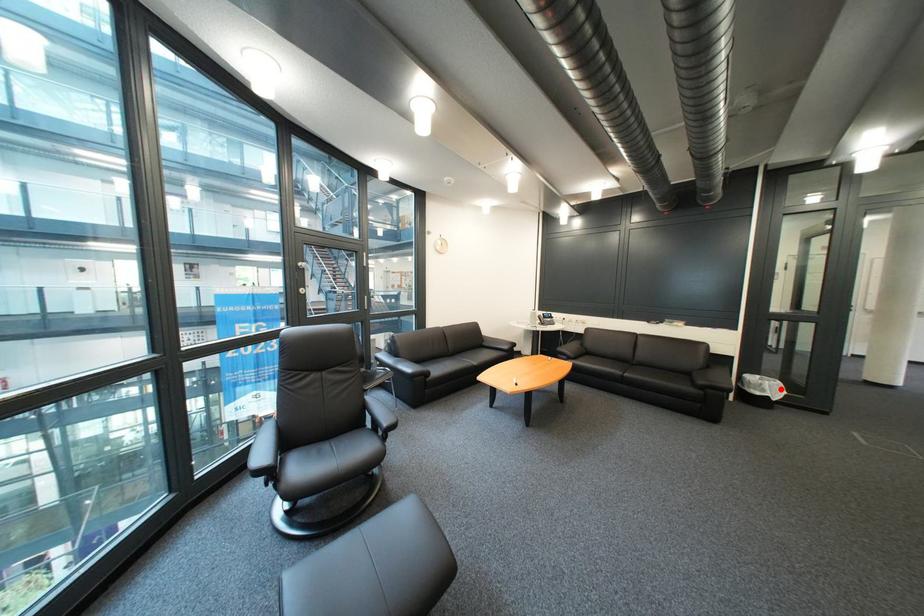
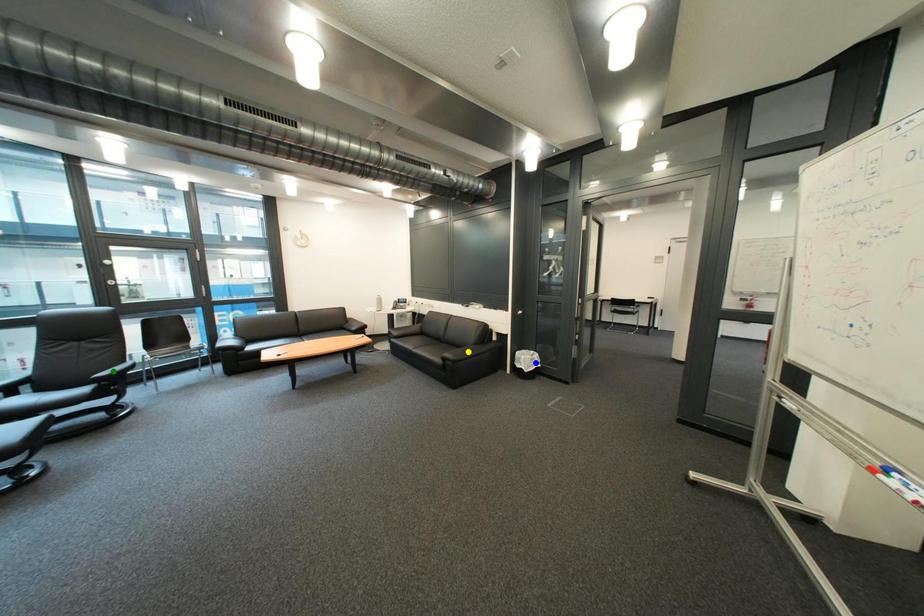
Question: I am providing you with two images of the same scene from different viewpoints. A red point is marked on the first image. You are given multiple points on the second image. Which point in image 2 represents the same 3d spot as the red point in image 1?

Choices:
 (A) green point
 (B) yellow point
 (C) blue point

Answer: (C)